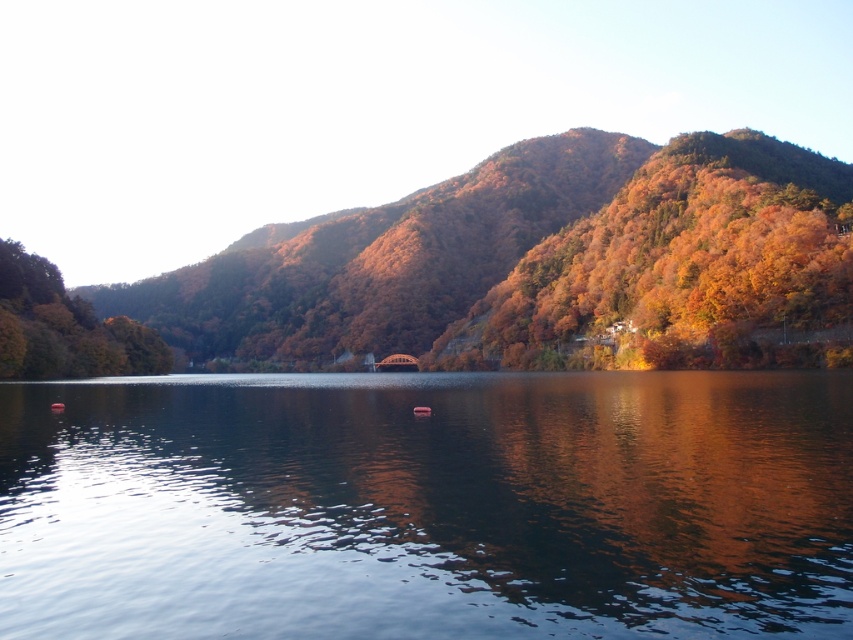
You are an artist trying to paint the scene. You notice the transparent water at center and autumn leaves at upper right. Which object in the scene has a smaller width?

The transparent water at center has a smaller width than the autumn leaves at upper right.

You are standing on the bridge and looking at the transparent water at center and the green matte tree at left. Which object appears taller from your viewpoint?

The green matte tree at left appears taller than the transparent water at center from your viewpoint.